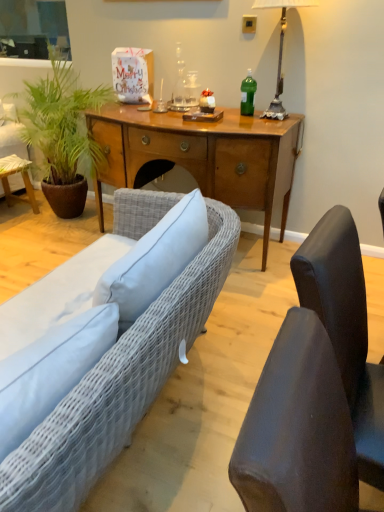
Question: From the image's perspective, is wooden desk at center positioned above or below green leafy plant at left?

Choices:
 (A) below
 (B) above

Answer: (A)

Question: Considering the relative positions of wooden desk at center and green leafy plant at left in the image provided, is wooden desk at center to the left or to the right of green leafy plant at left?

Choices:
 (A) right
 (B) left

Answer: (A)

Question: Which object is the closest to the wooden desk at center?

Choices:
 (A) green leafy plant at left
 (B) woven fabric couch at lower left
 (C) metallic silver lamp at upper right
 (D) matte gray chair at right, the first chair viewed from the front
 (E) dark gray fabric chair at right, which ranks as the second chair in front-to-back order

Answer: (A)

Question: Which object is the farthest from the green leafy plant at left?

Choices:
 (A) wooden desk at center
 (B) metallic silver lamp at upper right
 (C) matte gray chair at right, the first chair viewed from the front
 (D) green plastic bottle at center
 (E) dark gray fabric chair at right, which ranks as the second chair in front-to-back order

Answer: (C)